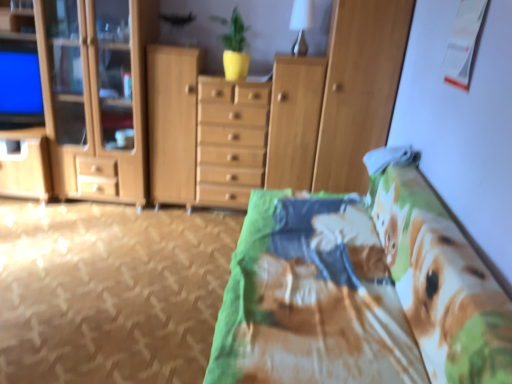
Question: From a real-world perspective, is wooden cabinet at center physically below printed fabric bed at center?

Choices:
 (A) no
 (B) yes

Answer: (A)

Question: From the image's perspective, does wooden cabinet at center appear lower than printed fabric bed at center?

Choices:
 (A) no
 (B) yes

Answer: (A)

Question: Is wooden cabinet at center far from printed fabric bed at center?

Choices:
 (A) yes
 (B) no

Answer: (A)

Question: Does wooden cabinet at center touch printed fabric bed at center?

Choices:
 (A) yes
 (B) no

Answer: (B)

Question: Is the position of wooden cabinet at center less distant than that of printed fabric bed at center?

Choices:
 (A) no
 (B) yes

Answer: (A)

Question: From the image's perspective, is wooden cabinet at center above printed fabric bed at center?

Choices:
 (A) no
 (B) yes

Answer: (B)

Question: Is wooden cabinet at center, the first cabinetry from the right, closer to camera compared to printed fabric bed at center?

Choices:
 (A) yes
 (B) no

Answer: (B)

Question: Is there a large distance between wooden cabinet at center, the first cabinetry from the right, and printed fabric bed at center?

Choices:
 (A) no
 (B) yes

Answer: (B)

Question: Is wooden cabinet at center, the second cabinetry positioned from the left, positioned with its back to printed fabric bed at center?

Choices:
 (A) no
 (B) yes

Answer: (A)

Question: Can you confirm if wooden cabinet at center, the first cabinetry from the right, is positioned to the right of printed fabric bed at center?

Choices:
 (A) no
 (B) yes

Answer: (B)

Question: From the image's perspective, is wooden cabinet at center, the second cabinetry positioned from the left, located beneath printed fabric bed at center?

Choices:
 (A) yes
 (B) no

Answer: (B)

Question: Could you tell me if wooden cabinet at center, the first cabinetry from the right, is turned towards printed fabric bed at center?

Choices:
 (A) yes
 (B) no

Answer: (A)

Question: Is wooden cabinet at left, which ranks as the second cabinetry in right-to-left order, inside wooden cabinet at center?

Choices:
 (A) yes
 (B) no

Answer: (B)